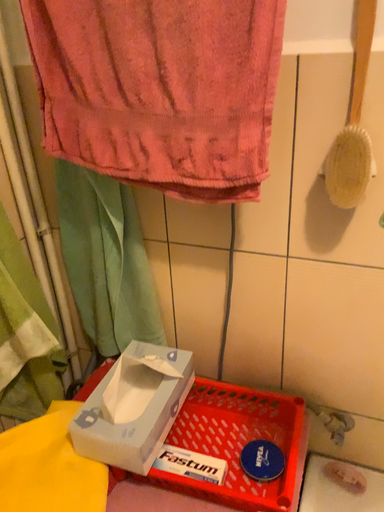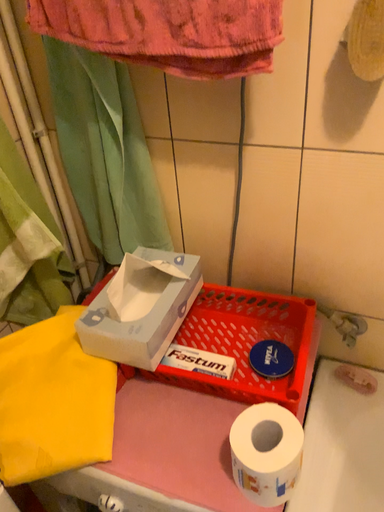
Question: Which way did the camera rotate in the video?

Choices:
 (A) rotated upward
 (B) rotated downward

Answer: (B)